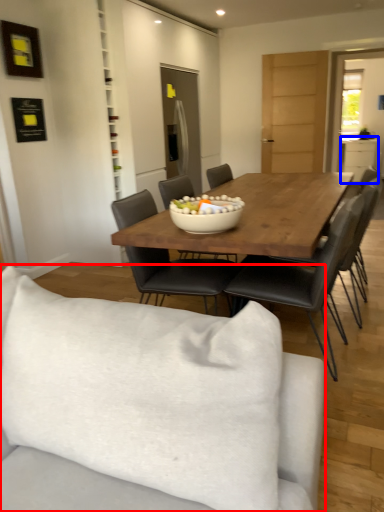
Question: Which object is closer to the camera taking this photo, studio couch (highlighted by a red box) or cabinetry (highlighted by a blue box)?

Choices:
 (A) studio couch
 (B) cabinetry

Answer: (A)